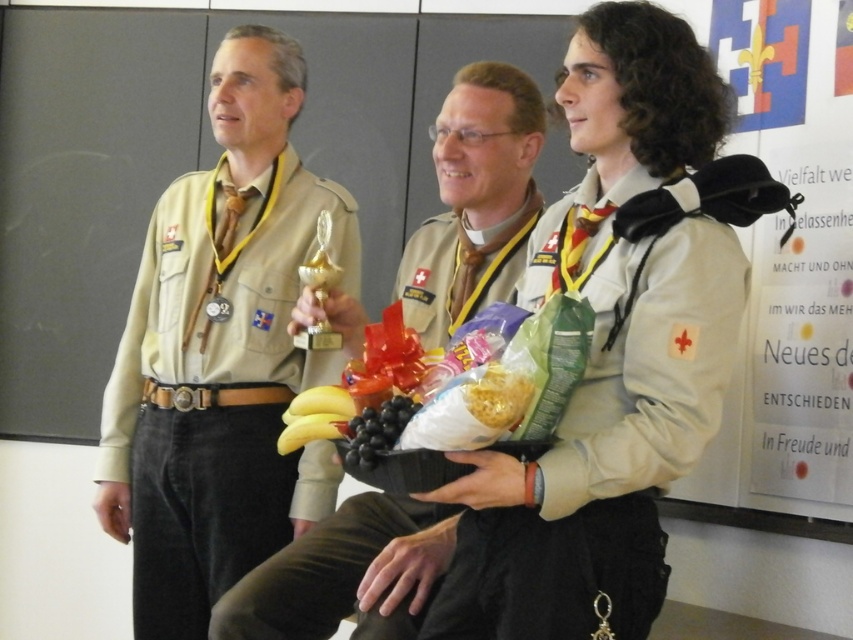
Question: Does beige fabric uniform at center lie behind black matte grapes at center?

Choices:
 (A) no
 (B) yes

Answer: (A)

Question: Which is farther from the black matte grapes at center?

Choices:
 (A) beige fabric uniform at center
 (B) gold shiny trophy at center
 (C) khaki uniform at center

Answer: (C)

Question: Is beige fabric uniform at center to the left of khaki uniform at center from the viewer's perspective?

Choices:
 (A) yes
 (B) no

Answer: (B)

Question: In this image, where is khaki uniform at center located relative to gold shiny trophy at center?

Choices:
 (A) above
 (B) below

Answer: (A)

Question: Which point is farther to the camera?

Choices:
 (A) matte khaki shirt at left
 (B) beige fabric uniform at center
 (C) black matte grapes at center

Answer: (A)

Question: Which of the following is the farthest from the observer?

Choices:
 (A) (317, 257)
 (B) (381, 422)

Answer: (A)